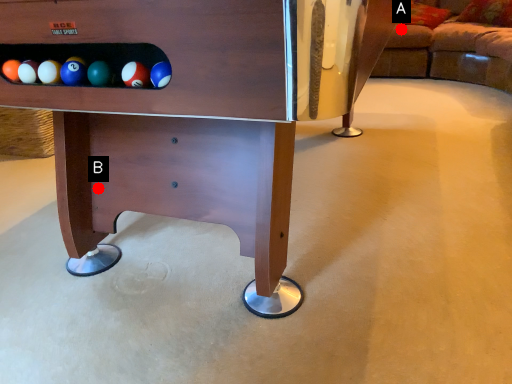
Question: Two points are circled on the image, labeled by A and B beside each circle. Which of the following is the farthest from the observer?

Choices:
 (A) A is further
 (B) B is further

Answer: (A)